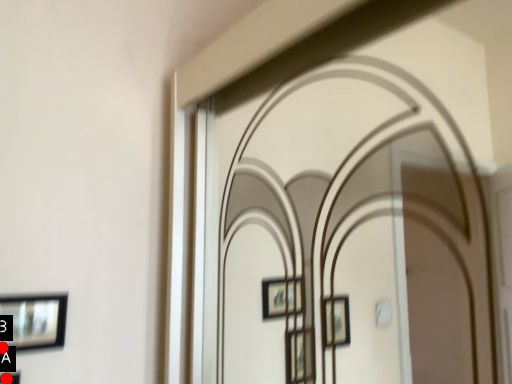
Question: Two points are circled on the image, labeled by A and B beside each circle. Among these points, which one is nearest to the camera?

Choices:
 (A) A is closer
 (B) B is closer

Answer: (A)